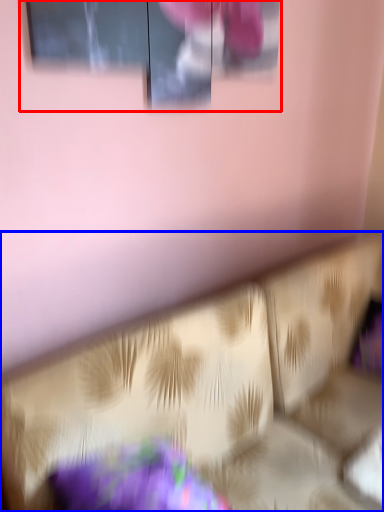
Question: Which of the following is the closest to the observer, window (highlighted by a red box) or furniture (highlighted by a blue box)?

Choices:
 (A) window
 (B) furniture

Answer: (B)